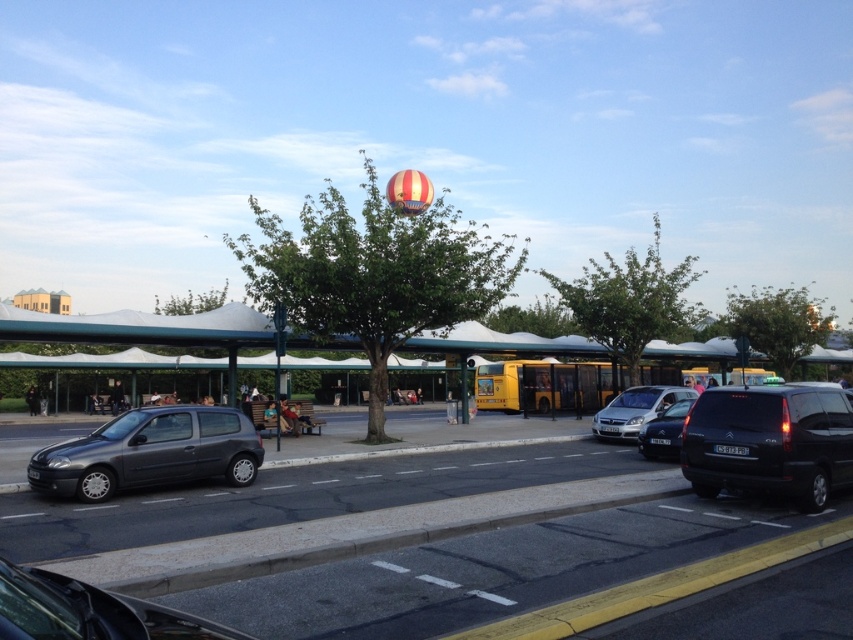
You are standing at the bus stop shelter in the street scene. You notice two points marked on the ground in front of you. The first point is at coordinates point (16, 582) and the second is at point (633, 401). Which point is closer to you?

Point (16, 582) is in front of point (633, 401), so the first point is closer to you.

You are a pedestrian standing at the bus stop shelter and want to cross the road to the other side. There is a metallic gray car at lower left and a satin silver van at center parked on the roadside. Which vehicle should you avoid walking behind when crossing the road?

You should avoid walking behind the metallic gray car at lower left because it is in front of the satin silver van at center and might start moving forward, blocking your path.

You are a delivery person who needs to park your vehicle between the black matte van at right and the metallic gray car at lower left. Given that your vehicle is 4.5 meters long, can you determine if there is enough space between these two vehicles to park?

The black matte van at right is bigger than the metallic gray car at lower left, but the exact distance between them isn not provided. Without knowing the space between the two vehicles, it is impossible to determine if your 4.5 meter vehicle can fit.